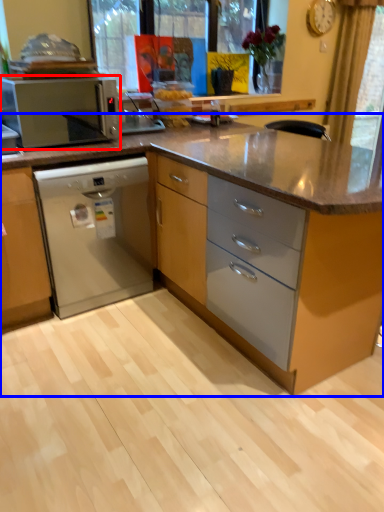
Question: Which object appears farthest to the camera in this image, kitchen appliance (highlighted by a red box) or cabinetry (highlighted by a blue box)?

Choices:
 (A) kitchen appliance
 (B) cabinetry

Answer: (A)